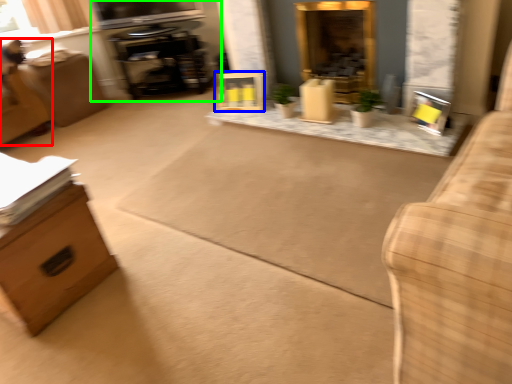
Question: Considering the real-world distances, which object is farthest from swivel chair (highlighted by a red box)? picture frame (highlighted by a blue box) or entertainment center (highlighted by a green box)?

Choices:
 (A) picture frame
 (B) entertainment center

Answer: (A)